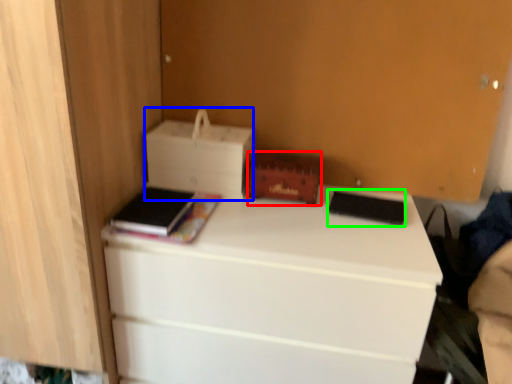
Question: Which object is the closest to the storage box (highlighted by a red box)? Choose among these: printer (highlighted by a blue box) or paperback book (highlighted by a green box).

Choices:
 (A) printer
 (B) paperback book

Answer: (A)